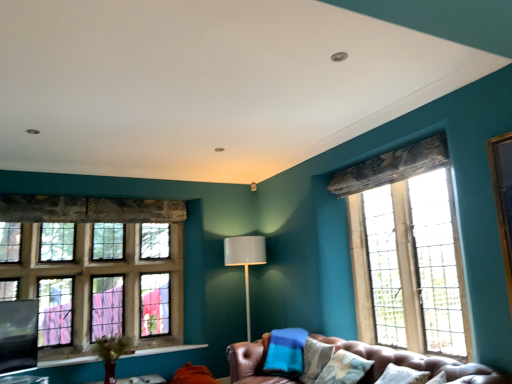
In order to face stained glass window at left, which is counted as the second window, starting from the right, should I rotate leftwards or rightwards?

Turn left approximately 20.666 degrees to face it.

Where is `matte gray lamp at center`? matte gray lamp at center is located at coordinates [245, 261].

You are a GUI agent. You are given a task and a screenshot of the screen. Output one action in this format:
    pyautogui.click(x=<x>, y=<y>)
    Task: Click on the wooden table at lower center
    The width and height of the screenshot is (512, 384).
    Given the screenshot: What is the action you would take?
    pyautogui.click(x=143, y=379)

Where is `stained glass window at left, which is counted as the second window, starting from the right`? stained glass window at left, which is counted as the second window, starting from the right is located at coordinates (95, 268).

Is matte gray lamp at center facing away from wooden table at lower center?

No, matte gray lamp at center's orientation is not away from wooden table at lower center.

Does matte gray lamp at center appear on the right side of wooden table at lower center?

Correct, you'll find matte gray lamp at center to the right of wooden table at lower center.

From a real-world perspective, is matte gray lamp at center physically located above or below wooden table at lower center?

Clearly, from a real-world perspective, matte gray lamp at center is above wooden table at lower center.

Is matte gray lamp at center bigger or smaller than wooden table at lower center?

In the image, matte gray lamp at center appears to be larger than wooden table at lower center.

How different are the orientations of stained glass window at left, the 1th window from the left, and black matte window screen at lower left in degrees?

The facing directions of stained glass window at left, the 1th window from the left, and black matte window screen at lower left are 37.2 degrees apart.

Is stained glass window at left, the 1th window from the back, next to black matte window screen at lower left?

There is a gap between stained glass window at left, the 1th window from the back, and black matte window screen at lower left.

From a real-world perspective, relative to black matte window screen at lower left, is stained glass window at left, marked as the second window in a front-to-back arrangement, vertically above or below?

Clearly, from a real-world perspective, stained glass window at left, marked as the second window in a front-to-back arrangement, is above black matte window screen at lower left.

Does stained glass window at left, the 1th window from the back, turn towards black matte window screen at lower left?

Yes, stained glass window at left, the 1th window from the back, is turned towards black matte window screen at lower left.

Looking at this image, is leather couch at lower center closer to the viewer compared to wooden table at lower center?

Yes.

Between leather couch at lower center and wooden table at lower center, which one appears on the left side from the viewer's perspective?

Positioned to the left is wooden table at lower center.

How many degrees apart are the facing directions of leather couch at lower center and wooden table at lower center?

They differ by 86.8 degrees in their facing directions.

Is wooden table at lower center at the back of leather couch at lower center?

No, wooden table at lower center is not at the back of leather couch at lower center.

Is matte gray lamp at center bigger than clear glass window at right, which is counted as the 2th window, starting from the back?

Indeed, matte gray lamp at center has a larger size compared to clear glass window at right, which is counted as the 2th window, starting from the back.

Would you say matte gray lamp at center contains clear glass window at right, which is counted as the 2th window, starting from the back?

That's incorrect, clear glass window at right, which is counted as the 2th window, starting from the back, is not inside matte gray lamp at center.

Considering the relative sizes of matte gray lamp at center and clear glass window at right, placed as the 1th window when sorted from front to back, in the image provided, is matte gray lamp at center thinner than clear glass window at right, placed as the 1th window when sorted from front to back,?

No.

In order to click on lamp behind the clear glass window at right, placed as the 1th window when sorted from front to back in this screenshot , I will do `click(245, 261)`.

From the image's perspective, between black matte window screen at lower left and leather couch at lower center, which one is located above?

black matte window screen at lower left appears higher in the image.

Is black matte window screen at lower left beside leather couch at lower center?

There is a gap between black matte window screen at lower left and leather couch at lower center.

Considering the relative sizes of black matte window screen at lower left and leather couch at lower center in the image provided, is black matte window screen at lower left wider than leather couch at lower center?

Incorrect, the width of black matte window screen at lower left does not surpass that of leather couch at lower center.

From the image's perspective, between leather couch at lower center and black matte window screen at lower left, who is located below?

leather couch at lower center.

Consider the image. Which of these two, leather couch at lower center or black matte window screen at lower left, is bigger?

leather couch at lower center is bigger.

Which of these two, leather couch at lower center or black matte window screen at lower left, stands shorter?

Standing shorter between the two is leather couch at lower center.

Is matte gray lamp at center spatially inside black matte window screen at lower left, or outside of it?

matte gray lamp at center cannot be found inside black matte window screen at lower left.

Locate an element on the screen. The height and width of the screenshot is (384, 512). window screen above the matte gray lamp at center (from the image's perspective) is located at coordinates coord(18,336).

Which of these two, matte gray lamp at center or black matte window screen at lower left, stands shorter?

Standing shorter between the two is black matte window screen at lower left.

Find the location of a particular element. This screenshot has height=384, width=512. lamp above the wooden table at lower center (from a real-world perspective) is located at coordinates (245, 261).

Starting from the black matte window screen at lower left, which window is the 1st one to the right? Please provide its 2D coordinates.

[(95, 268)]

When comparing their distances from wooden table at lower center, does clear glass window at right, which is counted as the 2th window, starting from the back, or leather couch at lower center seem closer?

Among the two, leather couch at lower center is located nearer to wooden table at lower center.

Looking at the image, which one is located further to wooden table at lower center, stained glass window at left, the 1th window from the back, or clear glass window at right, the second window from the left?

Based on the image, clear glass window at right, the second window from the left, appears to be further to wooden table at lower center.

When comparing their distances from stained glass window at left, which is counted as the second window, starting from the right, does matte gray lamp at center or clear glass window at right, placed as the 1th window when sorted from front to back, seem closer?

The object closer to stained glass window at left, which is counted as the second window, starting from the right, is matte gray lamp at center.

Based on their spatial positions, is leather couch at lower center or wooden table at lower center closer to matte gray lamp at center?

wooden table at lower center lies closer to matte gray lamp at center than the other object.

Looking at the image, which one is located closer to wooden table at lower center, clear glass window at right, placed as the 1th window when sorted from front to back, or stained glass window at left, marked as the second window in a front-to-back arrangement?

Based on the image, stained glass window at left, marked as the second window in a front-to-back arrangement, appears to be nearer to wooden table at lower center.

Estimate the real-world distances between objects in this image. Which object is further from clear glass window at right, placed as the 1th window when sorted from front to back, black matte window screen at lower left or stained glass window at left, marked as the second window in a front-to-back arrangement?

black matte window screen at lower left is further to clear glass window at right, placed as the 1th window when sorted from front to back.

Based on their spatial positions, is matte gray lamp at center or black matte window screen at lower left further from stained glass window at left, marked as the second window in a front-to-back arrangement?

matte gray lamp at center.

Estimate the real-world distances between objects in this image. Which object is closer to clear glass window at right, placed as the 1th window when sorted from front to back, wooden table at lower center or stained glass window at left, which is counted as the second window, starting from the right?

Based on the image, stained glass window at left, which is counted as the second window, starting from the right, appears to be nearer to clear glass window at right, placed as the 1th window when sorted from front to back.

The image size is (512, 384). I want to click on window between black matte window screen at lower left and matte gray lamp at center, so 95,268.

Locate an element on the screen. The image size is (512, 384). lamp between wooden table at lower center and clear glass window at right, placed as the 1th window when sorted from front to back, in the horizontal direction is located at coordinates (x=245, y=261).

The image size is (512, 384). In order to click on table between black matte window screen at lower left and leather couch at lower center from left to right in this screenshot , I will do `click(143, 379)`.

Identify the location of table between leather couch at lower center and matte gray lamp at center along the z-axis. The width and height of the screenshot is (512, 384). (143, 379).